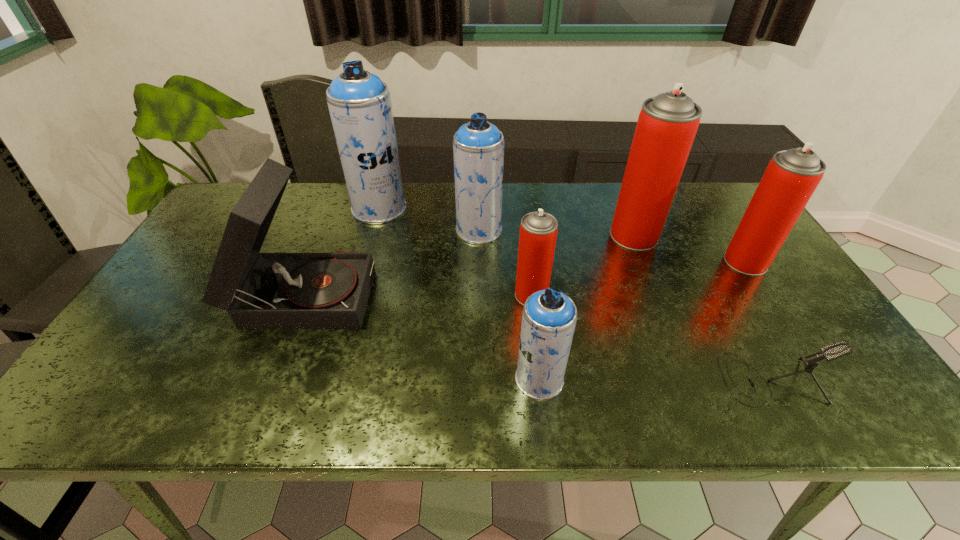
In order to click on free space located on the back of the nearest blue aerosol can in this screenshot , I will do `click(531, 303)`.

Where is `vacant space located 0.260m on the stand of the shortest object`? This screenshot has height=540, width=960. vacant space located 0.260m on the stand of the shortest object is located at coordinates (605, 379).

You are a GUI agent. You are given a task and a screenshot of the screen. Output one action in this format:
    pyautogui.click(x=<x>, y=<y>)
    Task: Click on the vacant space situated 0.230m on the stand of the shortest object
    This screenshot has width=960, height=540.
    Given the screenshot: What is the action you would take?
    pyautogui.click(x=619, y=379)

Where is `free location located on the stand of the shortest object`? This screenshot has width=960, height=540. free location located on the stand of the shortest object is located at coordinates (669, 379).

Where is `aerosol can that is positioned at the near edge`? This screenshot has width=960, height=540. aerosol can that is positioned at the near edge is located at coordinates (549, 317).

Image resolution: width=960 pixels, height=540 pixels. In order to click on microphone that is positioned at the near edge in this screenshot , I will do `click(834, 351)`.

Image resolution: width=960 pixels, height=540 pixels. In order to click on aerosol can situated at the right edge in this screenshot , I will do `click(791, 177)`.

Identify the location of microphone that is at the right edge. The height and width of the screenshot is (540, 960). (834, 351).

Image resolution: width=960 pixels, height=540 pixels. I want to click on object that is at the near right corner, so click(834, 351).

Where is `free region at the far edge of the desktop`? free region at the far edge of the desktop is located at coordinates (676, 202).